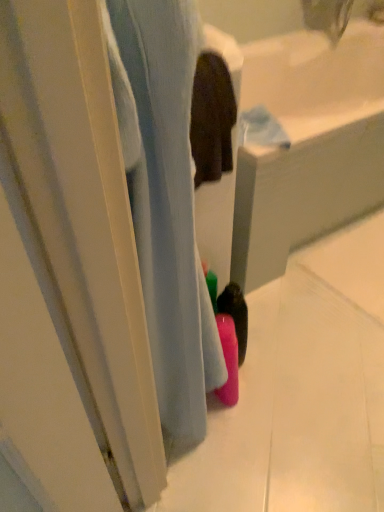
Where is `pink matte bottle at center, the second bath viewed from the front`? pink matte bottle at center, the second bath viewed from the front is located at coordinates (308, 145).

The height and width of the screenshot is (512, 384). Describe the element at coordinates (308, 145) in the screenshot. I see `pink matte bottle at center, the second bath viewed from the front` at that location.

Describe the element at coordinates (165, 202) in the screenshot. Image resolution: width=384 pixels, height=512 pixels. I see `pink matte bottle at lower center, which is the 2th bath in back-to-front order` at that location.

You are a GUI agent. You are given a task and a screenshot of the screen. Output one action in this format:
    pyautogui.click(x=<x>, y=<y>)
    Task: Click on the pink matte bottle at lower center, arranged as the 1th bath when viewed from the front
    
    Given the screenshot: What is the action you would take?
    pyautogui.click(x=165, y=202)

Measure the distance between pink matte bottle at lower center, which is the 2th bath in back-to-front order, and camera.

13.84 inches.

This screenshot has height=512, width=384. I want to click on pink matte bottle at center, the 1th bath viewed from the back, so click(x=308, y=145).

Does pink matte bottle at center, the second bath viewed from the front, appear on the left side of pink matte bottle at lower center, arranged as the 1th bath when viewed from the front?

Incorrect, pink matte bottle at center, the second bath viewed from the front, is not on the left side of pink matte bottle at lower center, arranged as the 1th bath when viewed from the front.

Considering the positions of objects pink matte bottle at center, the 1th bath viewed from the back, and pink matte bottle at lower center, which is the 2th bath in back-to-front order, in the image provided, who is behind, pink matte bottle at center, the 1th bath viewed from the back, or pink matte bottle at lower center, which is the 2th bath in back-to-front order,?

pink matte bottle at center, the 1th bath viewed from the back, is further from the camera.

Considering the points (362, 38) and (202, 406), which point is behind, point (362, 38) or point (202, 406)?

The point (362, 38) is farther from the camera.

From the image's perspective, is pink matte bottle at center, the second bath viewed from the front, beneath pink matte bottle at lower center, arranged as the 1th bath when viewed from the front?

Actually, pink matte bottle at center, the second bath viewed from the front, appears above pink matte bottle at lower center, arranged as the 1th bath when viewed from the front, in the image.

From a real-world perspective, is pink matte bottle at center, the second bath viewed from the front, under pink matte bottle at lower center, arranged as the 1th bath when viewed from the front?

Yes.

Can you confirm if pink matte bottle at center, the 1th bath viewed from the back, is wider than pink matte bottle at lower center, arranged as the 1th bath when viewed from the front?

Indeed, pink matte bottle at center, the 1th bath viewed from the back, has a greater width compared to pink matte bottle at lower center, arranged as the 1th bath when viewed from the front.

In terms of height, does pink matte bottle at center, the second bath viewed from the front, look taller or shorter compared to pink matte bottle at lower center, arranged as the 1th bath when viewed from the front?

Considering their sizes, pink matte bottle at center, the second bath viewed from the front, has less height than pink matte bottle at lower center, arranged as the 1th bath when viewed from the front.

In terms of size, does pink matte bottle at center, the second bath viewed from the front, appear bigger or smaller than pink matte bottle at lower center, which is the 2th bath in back-to-front order?

Considering their sizes, pink matte bottle at center, the second bath viewed from the front, takes up more space than pink matte bottle at lower center, which is the 2th bath in back-to-front order.

Is pink matte bottle at lower center, arranged as the 1th bath when viewed from the front, inside pink matte bottle at center, the 1th bath viewed from the back?

No, pink matte bottle at lower center, arranged as the 1th bath when viewed from the front, is located outside of pink matte bottle at center, the 1th bath viewed from the back.

Is pink matte bottle at center, the second bath viewed from the front, touching pink matte bottle at lower center, which is the 2th bath in back-to-front order?

pink matte bottle at center, the second bath viewed from the front, and pink matte bottle at lower center, which is the 2th bath in back-to-front order, are not in contact.

Does pink matte bottle at center, the 1th bath viewed from the back, turn towards pink matte bottle at lower center, arranged as the 1th bath when viewed from the front?

No, pink matte bottle at center, the 1th bath viewed from the back, is not turned towards pink matte bottle at lower center, arranged as the 1th bath when viewed from the front.

Can you tell me how much pink matte bottle at center, the second bath viewed from the front, and pink matte bottle at lower center, which is the 2th bath in back-to-front order, differ in facing direction?

There is a 1.83e-05-degree angle between the facing directions of pink matte bottle at center, the second bath viewed from the front, and pink matte bottle at lower center, which is the 2th bath in back-to-front order.

Looking at this image, how distant is pink matte bottle at center, the 1th bath viewed from the back, from pink matte bottle at lower center, arranged as the 1th bath when viewed from the front?

pink matte bottle at center, the 1th bath viewed from the back, and pink matte bottle at lower center, arranged as the 1th bath when viewed from the front, are 22.95 inches apart from each other.

Image resolution: width=384 pixels, height=512 pixels. Find the location of `bath lying in front of the pink matte bottle at center, the 1th bath viewed from the back`. bath lying in front of the pink matte bottle at center, the 1th bath viewed from the back is located at coordinates (165, 202).

Is pink matte bottle at lower center, arranged as the 1th bath when viewed from the front, at the right side of pink matte bottle at center, the second bath viewed from the front?

In fact, pink matte bottle at lower center, arranged as the 1th bath when viewed from the front, is to the left of pink matte bottle at center, the second bath viewed from the front.

Who is more distant, pink matte bottle at lower center, which is the 2th bath in back-to-front order, or pink matte bottle at center, the 1th bath viewed from the back?

pink matte bottle at center, the 1th bath viewed from the back, is behind.

Does point (158, 395) appear closer or farther from the camera than point (329, 161)?

Point (158, 395).

From the image's perspective, is pink matte bottle at lower center, which is the 2th bath in back-to-front order, on top of pink matte bottle at center, the second bath viewed from the front?

No, from the image's perspective, pink matte bottle at lower center, which is the 2th bath in back-to-front order, is not over pink matte bottle at center, the second bath viewed from the front.

From a real-world perspective, between pink matte bottle at lower center, which is the 2th bath in back-to-front order, and pink matte bottle at center, the 1th bath viewed from the back, who is vertically lower?

In real-world perspective, pink matte bottle at center, the 1th bath viewed from the back, is lower.

Between pink matte bottle at lower center, which is the 2th bath in back-to-front order, and pink matte bottle at center, the 1th bath viewed from the back, which one has larger width?

With larger width is pink matte bottle at center, the 1th bath viewed from the back.

In terms of height, does pink matte bottle at lower center, which is the 2th bath in back-to-front order, look taller or shorter compared to pink matte bottle at center, the 1th bath viewed from the back?

pink matte bottle at lower center, which is the 2th bath in back-to-front order, is taller than pink matte bottle at center, the 1th bath viewed from the back.

Between pink matte bottle at lower center, arranged as the 1th bath when viewed from the front, and pink matte bottle at center, the second bath viewed from the front, which one has smaller size?

pink matte bottle at lower center, arranged as the 1th bath when viewed from the front.

Is pink matte bottle at lower center, which is the 2th bath in back-to-front order, situated inside pink matte bottle at center, the 1th bath viewed from the back, or outside?

pink matte bottle at lower center, which is the 2th bath in back-to-front order, is spatially situated outside pink matte bottle at center, the 1th bath viewed from the back.

Is pink matte bottle at lower center, which is the 2th bath in back-to-front order, not near pink matte bottle at center, the second bath viewed from the front?

No, there isn't a large distance between pink matte bottle at lower center, which is the 2th bath in back-to-front order, and pink matte bottle at center, the second bath viewed from the front.

Is pink matte bottle at lower center, which is the 2th bath in back-to-front order, aimed at pink matte bottle at center, the 1th bath viewed from the back?

No, pink matte bottle at lower center, which is the 2th bath in back-to-front order, does not turn towards pink matte bottle at center, the 1th bath viewed from the back.

Identify the location of bath above the pink matte bottle at center, the second bath viewed from the front (from a real-world perspective). (165, 202).

This screenshot has width=384, height=512. I want to click on bath to the left of pink matte bottle at center, the second bath viewed from the front, so click(x=165, y=202).

This screenshot has width=384, height=512. In order to click on bath located underneath the pink matte bottle at lower center, arranged as the 1th bath when viewed from the front (from a real-world perspective) in this screenshot , I will do `click(308, 145)`.